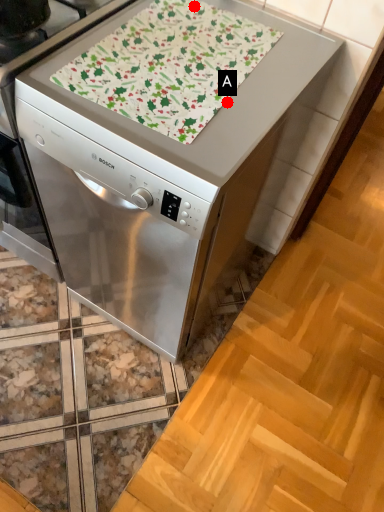
Question: Two points are circled on the image, labeled by A and B beside each circle. Which point appears closest to the camera in this image?

Choices:
 (A) A is closer
 (B) B is closer

Answer: (A)